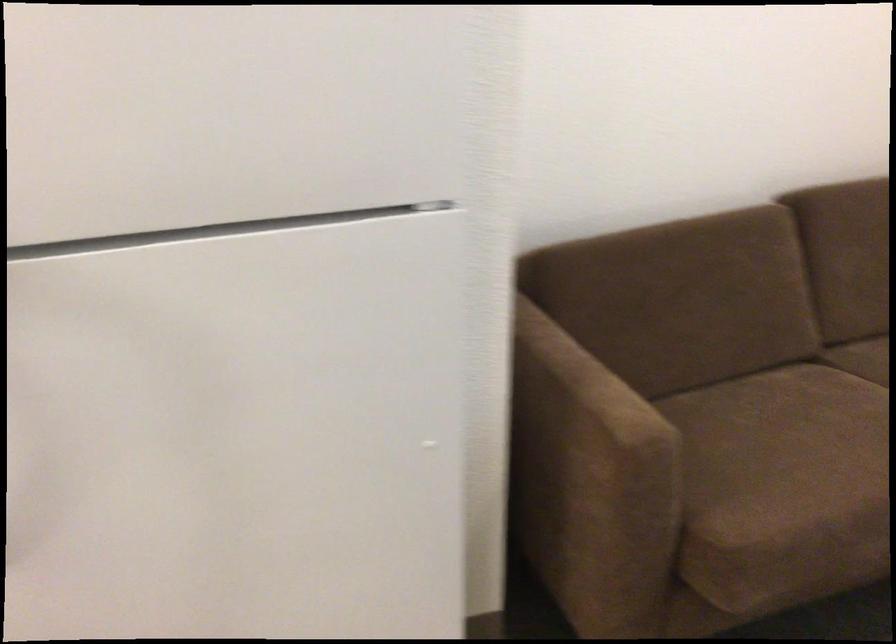
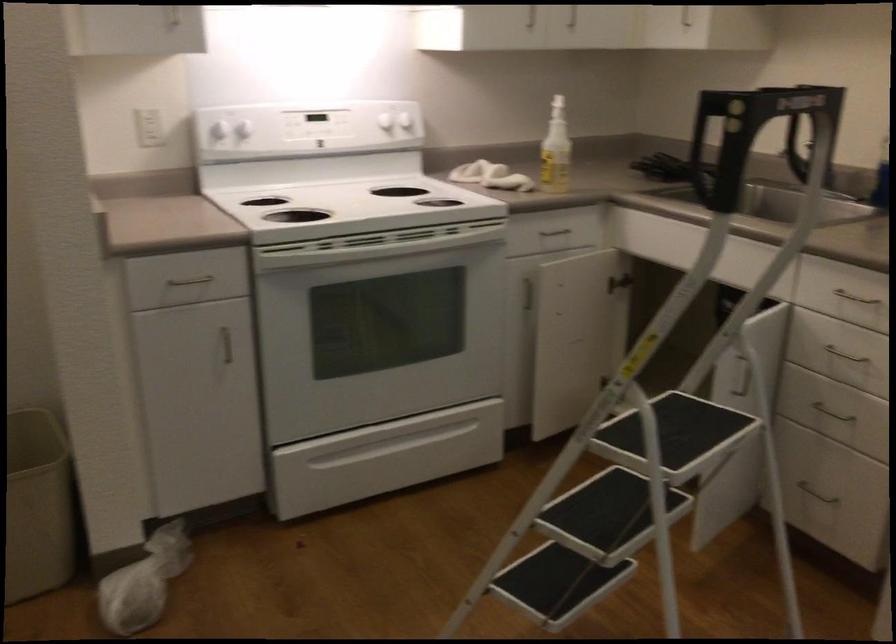
Question: The camera is either moving clockwise (left) or counter-clockwise (right) around the object. The first image is from the beginning of the video and the second image is from the end. Is the camera moving left or right when shooting the video?

Choices:
 (A) Left
 (B) Right

Answer: (B)